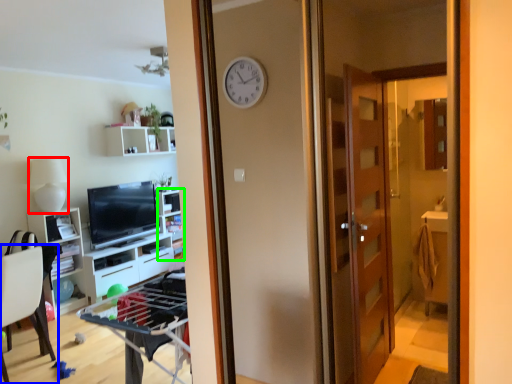
Question: Which object is the closest to the lamp (highlighted by a red box)? Choose among these: chair (highlighted by a blue box) or shelf (highlighted by a green box).

Choices:
 (A) chair
 (B) shelf

Answer: (A)